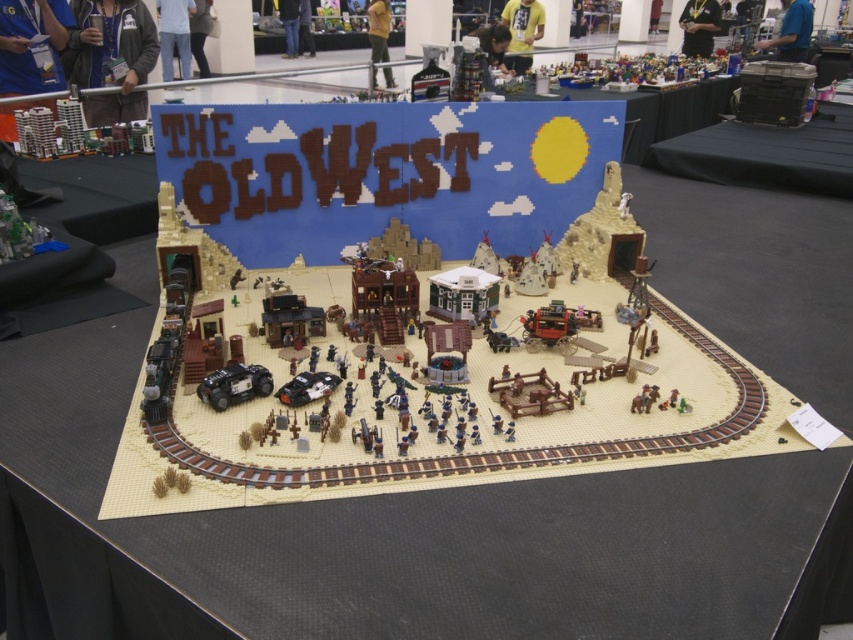
Question: Is matte plastic toy at upper center wider than dark gray plastic car at center?

Choices:
 (A) yes
 (B) no

Answer: (A)

Question: Among these points, which one is nearest to the camera?

Choices:
 (A) (241, 376)
 (B) (590, 77)

Answer: (A)

Question: Can you confirm if matte plastic toy at upper center is thinner than dark gray plastic car at center?

Choices:
 (A) no
 (B) yes

Answer: (A)

Question: Does matte plastic toy at upper center have a greater width compared to dark gray plastic car at center?

Choices:
 (A) yes
 (B) no

Answer: (A)

Question: Which object is closer to the camera taking this photo?

Choices:
 (A) matte plastic toy at upper center
 (B) dark gray plastic car at center

Answer: (B)